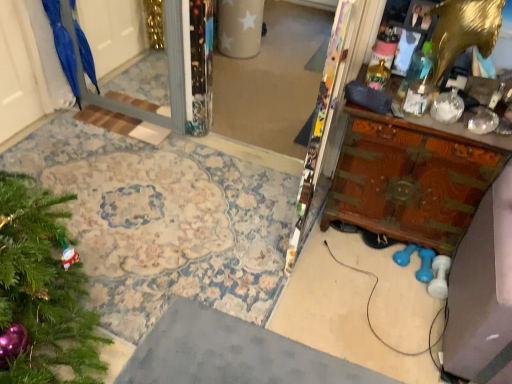
Image resolution: width=512 pixels, height=384 pixels. Identify the location of free space in front of wooden carved vanity at right. (368, 297).